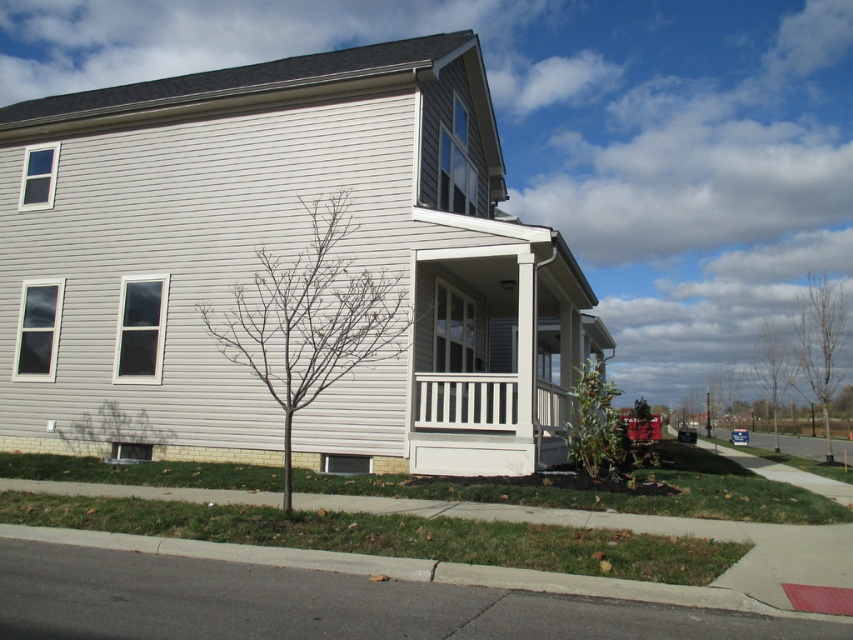
Question: Which of the following is the closest to the observer?

Choices:
 (A) green leafy plant at lower right
 (B) bare branches at right
 (C) bare branches at lower center
 (D) bare wood tree at right

Answer: (A)

Question: Is bare wood tree at right to the left of green leafy plant at lower right from the viewer's perspective?

Choices:
 (A) yes
 (B) no

Answer: (B)

Question: Is bare wood tree at right smaller than green leafy plant at lower right?

Choices:
 (A) yes
 (B) no

Answer: (B)

Question: Which of the following is the farthest from the observer?

Choices:
 (A) bare branches at lower center
 (B) bare wood tree at right
 (C) bare branches at right

Answer: (C)

Question: Which of the following is the farthest from the observer?

Choices:
 (A) (611, 412)
 (B) (795, 355)

Answer: (B)

Question: Considering the relative positions of bare wood tree at right and green leafy plant at lower right in the image provided, where is bare wood tree at right located with respect to green leafy plant at lower right?

Choices:
 (A) above
 (B) below

Answer: (B)